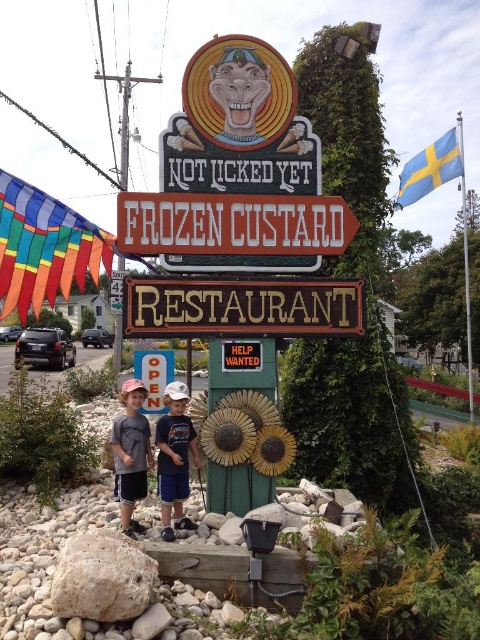
Does white painted wood signboard at center appear over light blue denim shorts at center?

Correct, white painted wood signboard at center is located above light blue denim shorts at center.

Can you confirm if white painted wood signboard at center is bigger than light blue denim shorts at center?

Incorrect, white painted wood signboard at center is not larger than light blue denim shorts at center.

Image resolution: width=480 pixels, height=640 pixels. Identify the location of white painted wood signboard at center. (232, 225).

From the picture: Which is below, white painted wood signboard at center or gray cotton shirt at lower center?

gray cotton shirt at lower center is below.

Can you confirm if white painted wood signboard at center is positioned above gray cotton shirt at lower center?

Correct, white painted wood signboard at center is located above gray cotton shirt at lower center.

Where is `white painted wood signboard at center`? white painted wood signboard at center is located at coordinates [232, 225].

Which is behind, point (252, 323) or point (172, 480)?

Positioned behind is point (252, 323).

Locate an element on the screen. The image size is (480, 640). brown wooden sign at center is located at coordinates (241, 307).

Where is `brown wooden sign at center`? This screenshot has width=480, height=640. brown wooden sign at center is located at coordinates (241, 307).